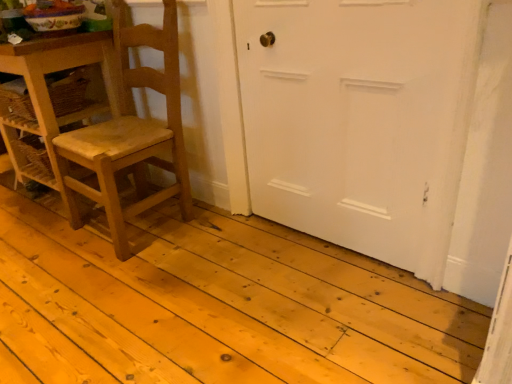
This screenshot has width=512, height=384. In order to click on vacant area that lies between white matte door at center and wooden chair at left in this screenshot , I will do `click(233, 249)`.